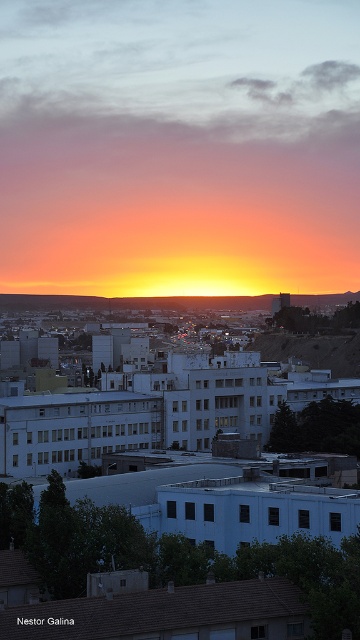
Question: Can you confirm if matte orange sky at center is positioned above brown rocky hill at center?

Choices:
 (A) no
 (B) yes

Answer: (B)

Question: Can you confirm if matte orange sky at center is positioned to the left of brown rocky hill at center?

Choices:
 (A) no
 (B) yes

Answer: (B)

Question: Does matte orange sky at center have a greater width compared to brown rocky hill at center?

Choices:
 (A) yes
 (B) no

Answer: (A)